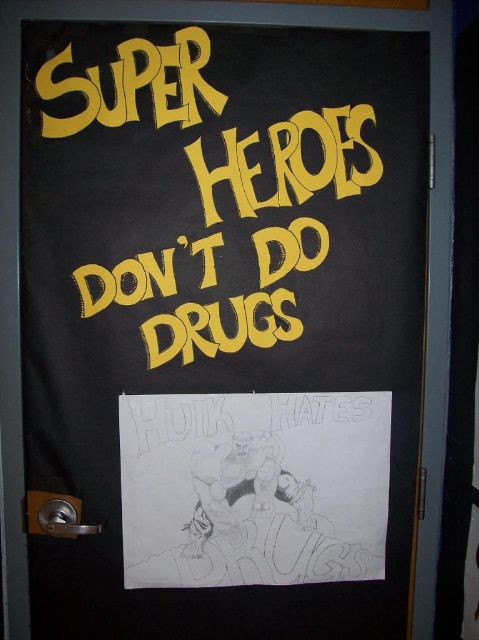
You are standing in front of the door with the superhero poster. You notice two points marked on the door at coordinates point (x=205, y=579) and point (x=284, y=326). Which point is closer to you?

Point (x=205, y=579) is further to the viewer than point (x=284, y=326), so the closer point to you is point (x=284, y=326).